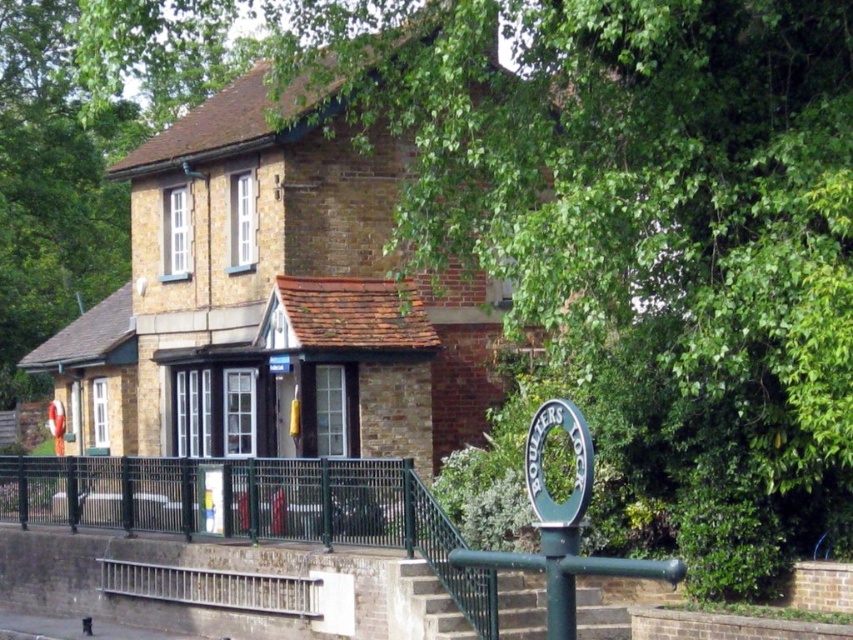
Who is positioned more to the right, green metal railing at lower center or green metallic pole at lower right?

From the viewer's perspective, green metallic pole at lower right appears more on the right side.

Can you confirm if green metal railing at lower center is thinner than green metallic pole at lower right?

No.

Is point (253, 538) positioned before point (552, 566)?

That is False.

The height and width of the screenshot is (640, 853). Find the location of `green metal railing at lower center`. green metal railing at lower center is located at coordinates (264, 509).

Consider the image. Measure the distance between green metal railing at lower center and camera.

The distance of green metal railing at lower center from camera is 10.39 meters.

Does green metal railing at lower center have a greater height compared to green plastic sign at lower right?

Yes, green metal railing at lower center is taller than green plastic sign at lower right.

Locate an element on the screen. green metal railing at lower center is located at coordinates (264, 509).

Identify the location of green metal railing at lower center. (264, 509).

Does green plastic sign at lower right appear under green metallic pole at lower right?

Incorrect, green plastic sign at lower right is not positioned below green metallic pole at lower right.

Does green plastic sign at lower right appear on the left side of green metallic pole at lower right?

Indeed, green plastic sign at lower right is positioned on the left side of green metallic pole at lower right.

Which is in front, point (560, 426) or point (546, 568)?

Point (546, 568)

Where is `green plastic sign at lower right`? This screenshot has height=640, width=853. green plastic sign at lower right is located at coordinates (573, 465).